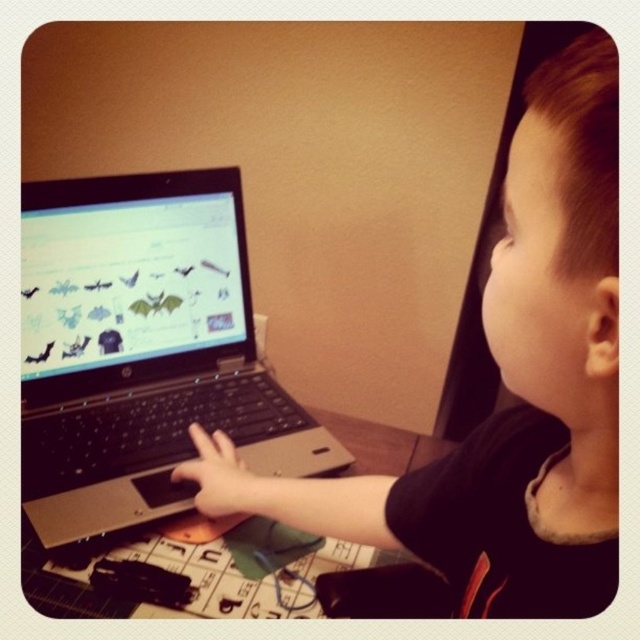
Between silver/black laptop at center and shiny silver laptop at center, which one is positioned lower?

silver/black laptop at center is lower down.

Based on the photo, between silver/black laptop at center and shiny silver laptop at center, which one appears on the left side from the viewer's perspective?

From the viewer's perspective, shiny silver laptop at center appears more on the left side.

This screenshot has height=640, width=640. What do you see at coordinates (141, 349) in the screenshot? I see `silver/black laptop at center` at bounding box center [141, 349].

At what (x,y) coordinates should I click in order to perform the action: click on silver/black laptop at center. Please return your answer as a coordinate pair (x, y). This screenshot has height=640, width=640. Looking at the image, I should click on (141, 349).

Can you confirm if shiny silver laptop at center is taller than matte black hand at center?

Indeed, shiny silver laptop at center has a greater height compared to matte black hand at center.

Who is shorter, shiny silver laptop at center or matte black hand at center?

With less height is matte black hand at center.

Image resolution: width=640 pixels, height=640 pixels. Describe the element at coordinates (131, 276) in the screenshot. I see `shiny silver laptop at center` at that location.

I want to click on shiny silver laptop at center, so click(x=131, y=276).

Looking at this image, who is lower down, wooden table at center or matte black hand at center?

wooden table at center

Is wooden table at center to the left of matte black hand at center from the viewer's perspective?

Incorrect, wooden table at center is not on the left side of matte black hand at center.

Who is more forward, (371, 424) or (244, 481)?

Positioned in front is point (244, 481).

Identify the location of wooden table at center. (380, 444).